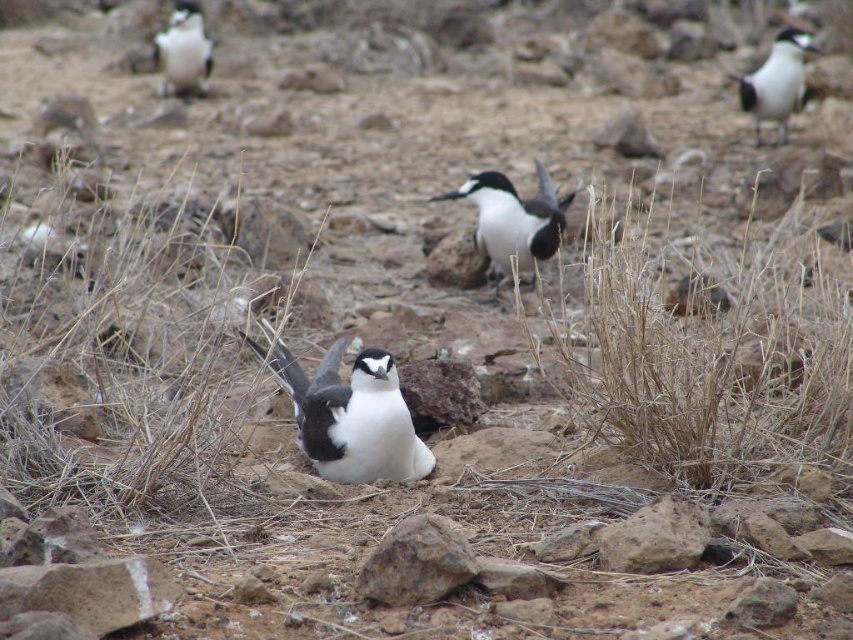
Question: Does brown rough rock at center appear over white glossy penguin at upper right?

Choices:
 (A) yes
 (B) no

Answer: (B)

Question: Among these points, which one is farthest from the camera?

Choices:
 (A) (173, 19)
 (B) (296, 394)
 (C) (459, 561)

Answer: (A)

Question: Which point appears closest to the camera in this image?

Choices:
 (A) (787, 33)
 (B) (483, 179)
 (C) (410, 554)

Answer: (C)

Question: Which of the following is the farthest from the observer?

Choices:
 (A) (761, 74)
 (B) (416, 561)
 (C) (498, 248)
 (D) (329, 461)

Answer: (A)

Question: Is brown rough rock at center to the left of white glossy penguin at upper right from the viewer's perspective?

Choices:
 (A) yes
 (B) no

Answer: (A)

Question: Does black glossy bird at center appear under white glossy penguin at upper right?

Choices:
 (A) no
 (B) yes

Answer: (B)